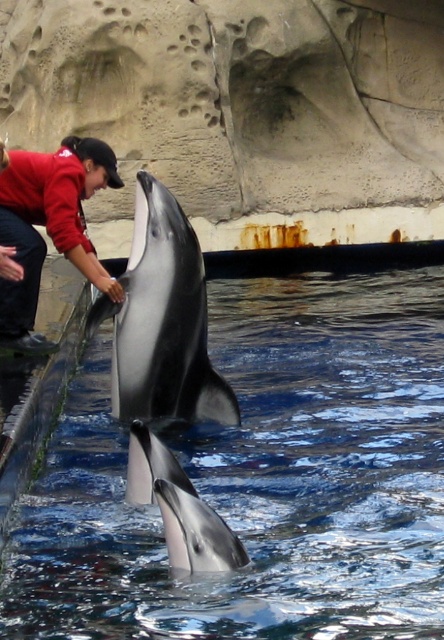
Is point (256, 604) closer to viewer compared to point (27, 195)?

Yes, it is in front of point (27, 195).

At what (x,y) coordinates should I click in order to perform the action: click on clear blue water at dolphin center. Please return your answer as a coordinate pair (x, y). Looking at the image, I should click on (260, 477).

This screenshot has height=640, width=444. What do you see at coordinates (260, 477) in the screenshot? I see `clear blue water at dolphin center` at bounding box center [260, 477].

Image resolution: width=444 pixels, height=640 pixels. Identify the location of clear blue water at dolphin center. (260, 477).

Does clear blue water at dolphin center have a greater height compared to black smooth dolphin at center?

Indeed, clear blue water at dolphin center has a greater height compared to black smooth dolphin at center.

Can you confirm if clear blue water at dolphin center is positioned below black smooth dolphin at center?

Yes.

Which is behind, point (99, 388) or point (209, 410)?

Positioned behind is point (99, 388).

Where is `clear blue water at dolphin center`? The height and width of the screenshot is (640, 444). clear blue water at dolphin center is located at coordinates (260, 477).

Can you confirm if black smooth dolphin at center is positioned to the left of red cotton shirt at left?

In fact, black smooth dolphin at center is to the right of red cotton shirt at left.

Where is `black smooth dolphin at center`? This screenshot has height=640, width=444. black smooth dolphin at center is located at coordinates (163, 321).

Where is `black smooth dolphin at center`? This screenshot has height=640, width=444. black smooth dolphin at center is located at coordinates (163, 321).